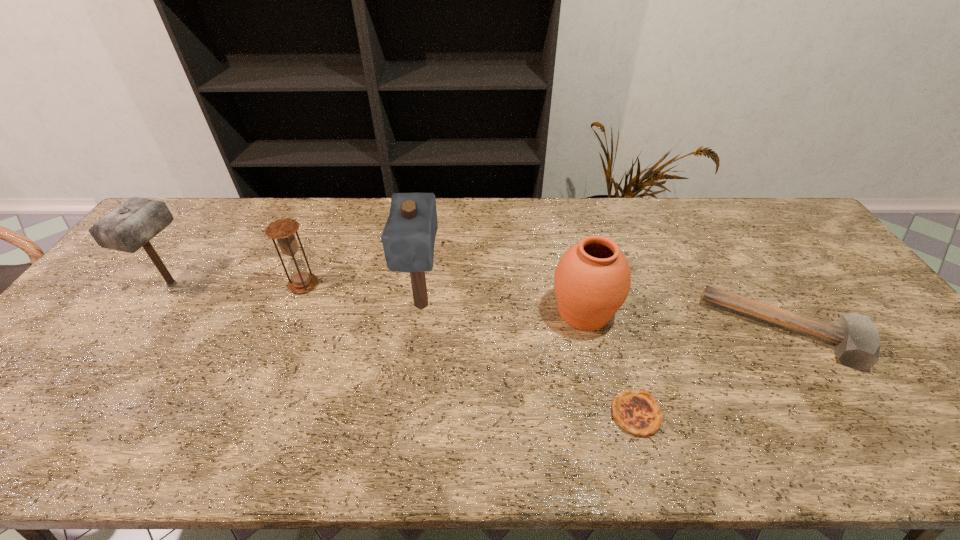
Where is `blank space at the far left corner of the desktop`? Image resolution: width=960 pixels, height=540 pixels. blank space at the far left corner of the desktop is located at coordinates (180, 232).

Where is `free region at the far right corner of the desktop`? This screenshot has width=960, height=540. free region at the far right corner of the desktop is located at coordinates (761, 233).

This screenshot has width=960, height=540. I want to click on free spot between the hourglass and the third object from left to right, so click(x=363, y=295).

I want to click on vacant region between the urn and the second shortest object, so click(x=684, y=321).

Where is `unoccupied area between the leftmost mallet and the fourth object from right to left`? The width and height of the screenshot is (960, 540). unoccupied area between the leftmost mallet and the fourth object from right to left is located at coordinates (297, 294).

Find the location of a particular element. free space between the quiche and the second mallet from right to left is located at coordinates (529, 360).

You are a GUI agent. You are given a task and a screenshot of the screen. Output one action in this format:
    pyautogui.click(x=<x>, y=<y>)
    Task: Click on the free area in between the rightmost object and the leftmost object
    The width and height of the screenshot is (960, 540).
    Given the screenshot: What is the action you would take?
    pyautogui.click(x=478, y=308)

I want to click on vacant space that's between the leftmost object and the urn, so click(378, 298).

You are a GUI agent. You are given a task and a screenshot of the screen. Output one action in this format:
    pyautogui.click(x=<x>, y=<y>)
    Task: Click on the free spot between the shortest mallet and the fifth object from right to left
    The width and height of the screenshot is (960, 540).
    Given the screenshot: What is the action you would take?
    pyautogui.click(x=544, y=308)

Identify the location of unoccupied position between the second object from left to right and the leftmost object. (238, 284).